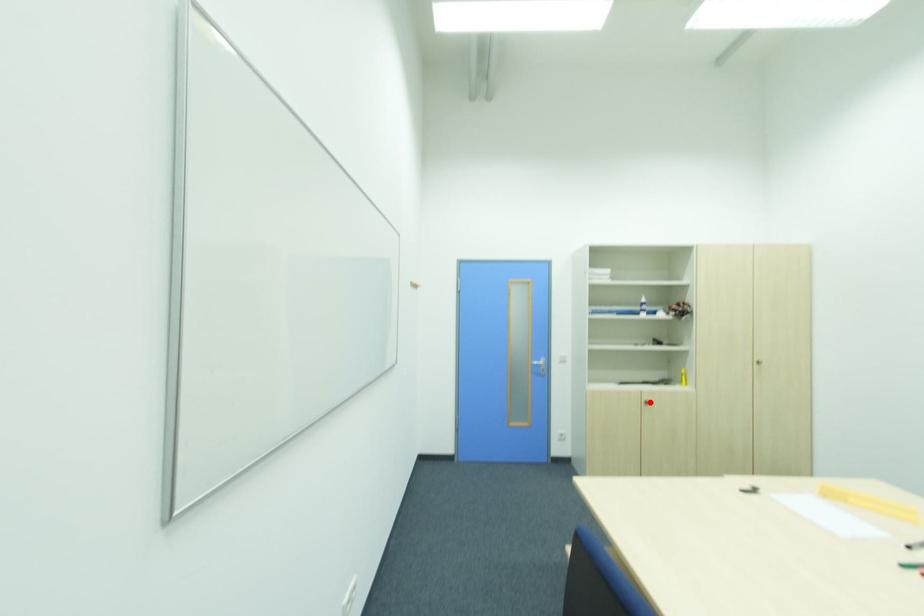
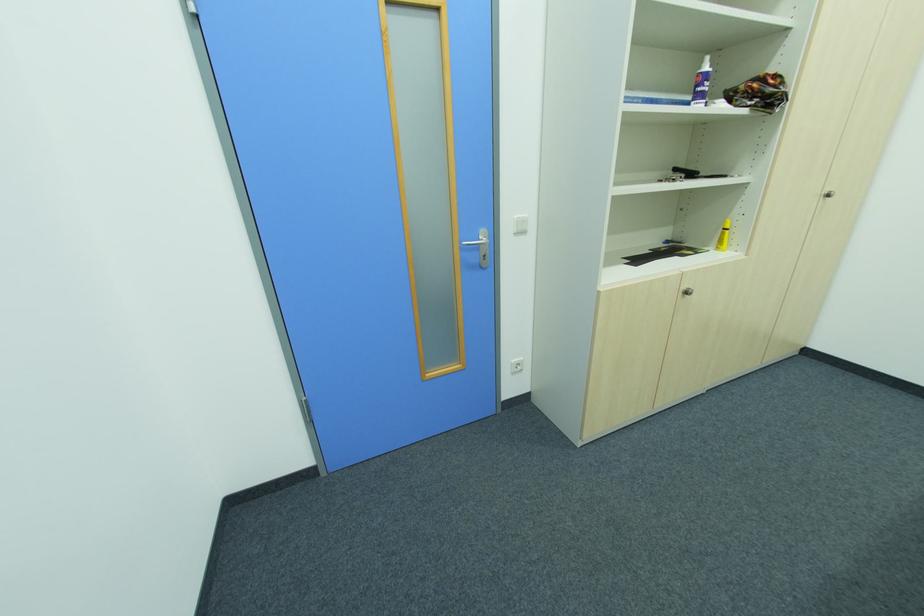
In the second image, find the point that corresponds to the highlighted location in the first image.

(689, 294)